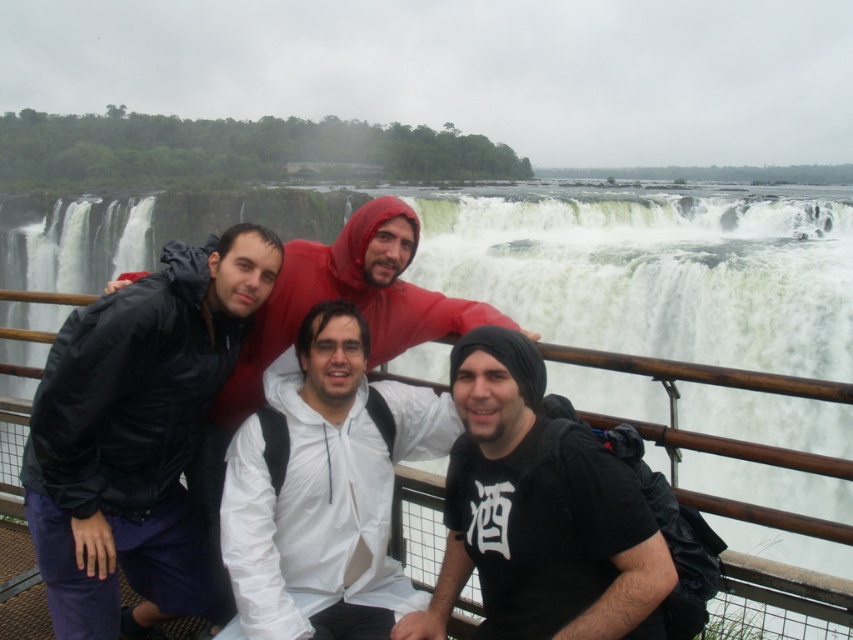
You are standing at the viewing platform near the waterfall and want to take a photo. There are two points marked on the railing where you can place your camera tripod. The first point is at coordinate point (x=547, y=598) and the second is at point (x=254, y=496). Which point will give your tripod a closer position to the waterfall for a more dramatic shot?

Point (x=547, y=598) is closer to the viewer than point (x=254, y=496). Therefore, placing the tripod at point (x=547, y=598) will position it closer to the waterfall, providing a more dramatic shot.

You are standing at the camera position and want to reach the point marked at coordinates point (146, 371). Is the distance manageable for a quick walk without any obstacles?

The point marked at coordinates point (146, 371) is 16.30 feet away from the camera, so yes, the distance is manageable for a quick walk without any obstacles.